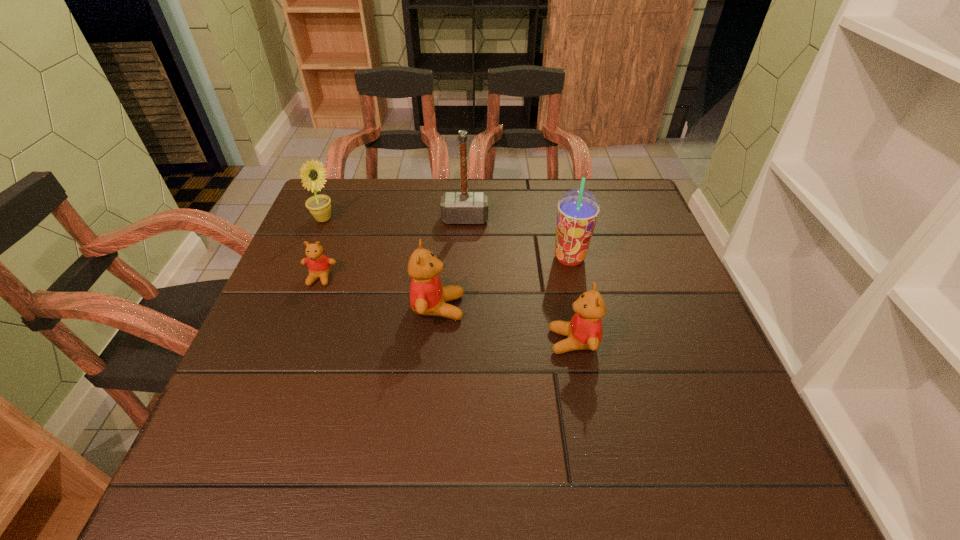
Find the location of a particular element. The height and width of the screenshot is (540, 960). blank space located 0.290m on the front-facing side of the second shortest teddy bear is located at coordinates pos(411,341).

This screenshot has width=960, height=540. What are the coordinates of `vacant region located on the front-facing side of the second shortest teddy bear` in the screenshot? It's located at (444, 341).

Find the location of a particular element. vacant space located on the front-facing side of the second shortest teddy bear is located at coordinates (411, 341).

The width and height of the screenshot is (960, 540). In order to click on free spot located 0.370m on the striking surface of the hammer in this screenshot , I will do `click(461, 334)`.

Locate an element on the screen. vacant space located 0.280m on the face of the sunflower is located at coordinates point(437,219).

Locate an element on the screen. The image size is (960, 540). blank space located 0.110m on the right of the smoothie is located at coordinates (633, 258).

This screenshot has height=540, width=960. In order to click on hammer located at the far edge in this screenshot , I will do `click(464, 207)`.

This screenshot has height=540, width=960. What are the coordinates of `sunflower present at the far edge` in the screenshot? It's located at (312, 173).

Find the location of a particular element. The width and height of the screenshot is (960, 540). teddy bear at the left edge is located at coordinates (319, 265).

Identify the location of sunflower that is at the left edge. (312, 173).